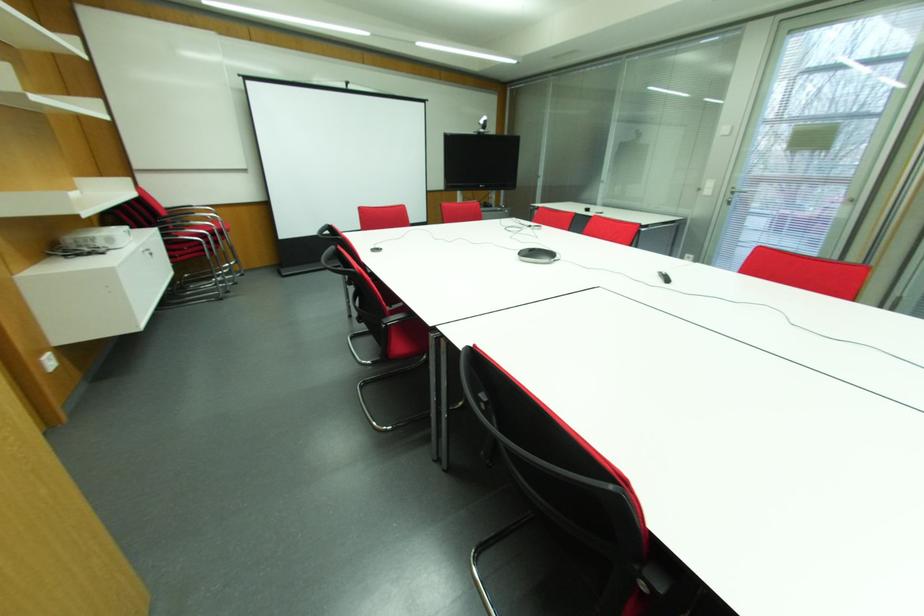
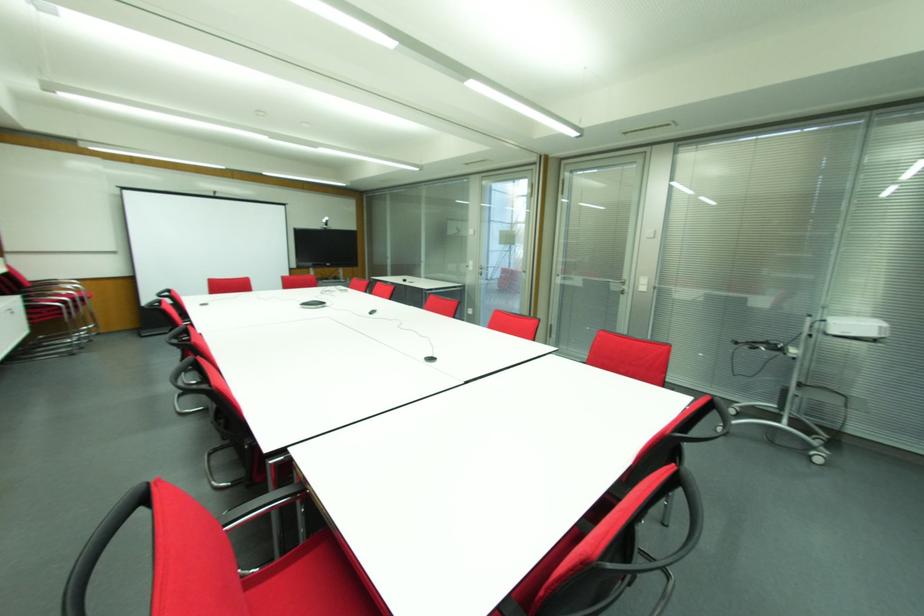
Where in the second image is the point corresponding to (728,201) from the first image?

(480, 274)